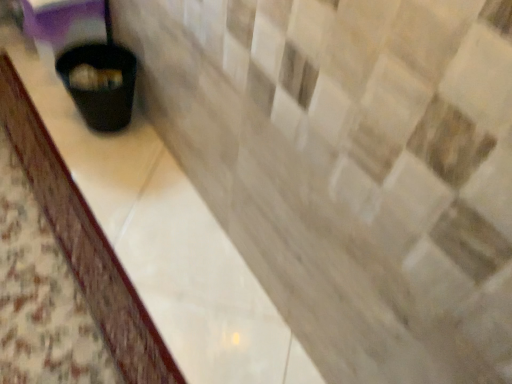
Measure the distance between point [86,217] and camera.

The depth of point [86,217] is 1.41 meters.

Find the location of a particular element. The height and width of the screenshot is (384, 512). black plastic trash can at lower left is located at coordinates (84, 241).

Describe the element at coordinates (84, 241) in the screenshot. I see `black plastic trash can at lower left` at that location.

Describe the element at coordinates (100, 83) in the screenshot. I see `black plastic waste container at lower left` at that location.

What is the approximate height of black plastic waste container at lower left?

black plastic waste container at lower left is 27.73 centimeters tall.

Locate an element on the screen. This screenshot has width=512, height=384. black plastic waste container at lower left is located at coordinates (100, 83).

Locate an element on the screen. black plastic trash can at lower left is located at coordinates (84, 241).

Considering the positions of objects black plastic trash can at lower left and black plastic waste container at lower left in the image provided, who is more to the right, black plastic trash can at lower left or black plastic waste container at lower left?

black plastic waste container at lower left is more to the right.

Is black plastic trash can at lower left in front of black plastic waste container at lower left?

Yes, black plastic trash can at lower left is in front of black plastic waste container at lower left.

Does point (42, 194) lie behind point (100, 55)?

No.

From the image's perspective, which is above, black plastic trash can at lower left or black plastic waste container at lower left?

From the image's view, black plastic waste container at lower left is above.

From a real-world perspective, does black plastic trash can at lower left sit lower than black plastic waste container at lower left?

Correct, in the physical world, black plastic trash can at lower left is lower than black plastic waste container at lower left.

Looking at their sizes, would you say black plastic trash can at lower left is wider or thinner than black plastic waste container at lower left?

In the image, black plastic trash can at lower left appears to be wider than black plastic waste container at lower left.

Which of these two, black plastic trash can at lower left or black plastic waste container at lower left, stands shorter?

Standing shorter between the two is black plastic trash can at lower left.

Considering the sizes of objects black plastic trash can at lower left and black plastic waste container at lower left in the image provided, who is bigger, black plastic trash can at lower left or black plastic waste container at lower left?

Bigger between the two is black plastic waste container at lower left.

Would you say black plastic trash can at lower left is inside or outside black plastic waste container at lower left?

black plastic trash can at lower left is not enclosed by black plastic waste container at lower left.

Is black plastic trash can at lower left beside black plastic waste container at lower left?

No, black plastic trash can at lower left is not touching black plastic waste container at lower left.

Is black plastic trash can at lower left positioned with its back to black plastic waste container at lower left?

No, black plastic waste container at lower left is not at the back of black plastic trash can at lower left.

How many degrees apart are the facing directions of black plastic trash can at lower left and black plastic waste container at lower left?

They differ by 91.9 degrees in their facing directions.

Measure the distance from black plastic trash can at lower left to black plastic waste container at lower left.

They are 13.43 inches apart.

Locate an element on the screen. The width and height of the screenshot is (512, 384). waste container above the black plastic trash can at lower left (from a real-world perspective) is located at coordinates (100, 83).

Is black plastic waste container at lower left to the left of black plastic trash can at lower left from the viewer's perspective?

No, black plastic waste container at lower left is not to the left of black plastic trash can at lower left.

Which is in front, black plastic waste container at lower left or black plastic trash can at lower left?

black plastic trash can at lower left is more forward.

Considering the positions of point (116, 73) and point (132, 336), is point (116, 73) closer or farther from the camera than point (132, 336)?

Point (116, 73) appears to be farther away from the viewer than point (132, 336).

From the image's perspective, would you say black plastic waste container at lower left is shown under black plastic trash can at lower left?

Incorrect, from the image's perspective, black plastic waste container at lower left is higher than black plastic trash can at lower left.

Based on the photo, from a real-world perspective, which is physically below, black plastic waste container at lower left or black plastic trash can at lower left?

black plastic trash can at lower left, from a real-world perspective.

Which of these two, black plastic waste container at lower left or black plastic trash can at lower left, is wider?

black plastic trash can at lower left.

Which of these two, black plastic waste container at lower left or black plastic trash can at lower left, stands taller?

Standing taller between the two is black plastic waste container at lower left.

Is black plastic waste container at lower left bigger than black plastic trash can at lower left?

Yes, black plastic waste container at lower left is bigger than black plastic trash can at lower left.

Is black plastic waste container at lower left completely or partially outside of black plastic trash can at lower left?

black plastic waste container at lower left lies outside black plastic trash can at lower left's area.

Is black plastic waste container at lower left next to black plastic trash can at lower left?

No, black plastic waste container at lower left is not with black plastic trash can at lower left.

Is black plastic waste container at lower left looking in the opposite direction of black plastic trash can at lower left?

black plastic waste container at lower left does not have its back to black plastic trash can at lower left.

Can you tell me how much black plastic waste container at lower left and black plastic trash can at lower left differ in facing direction?

The angle between the facing direction of black plastic waste container at lower left and the facing direction of black plastic trash can at lower left is 91.9 degrees.

Identify the location of counter top in front of the black plastic waste container at lower left. (84, 241).

In order to click on waste container above the black plastic trash can at lower left (from a real-world perspective) in this screenshot , I will do `click(100, 83)`.

The width and height of the screenshot is (512, 384). I want to click on counter top in front of the black plastic waste container at lower left, so click(84, 241).